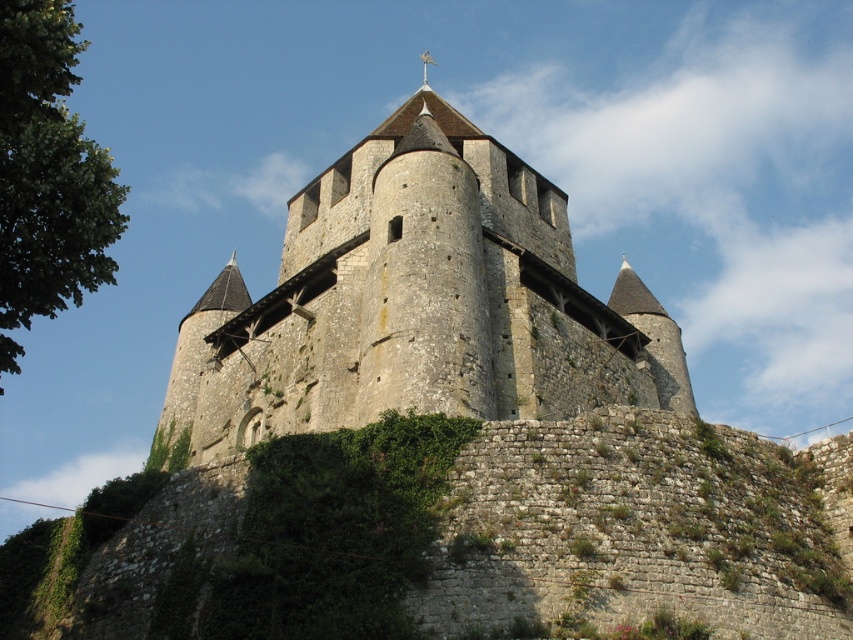
You are standing at the entrance of the medieval stone castle and see two points marked on the castle walls. The first point is at coordinate point (459, 554) and the second is at point (196, 422). Which point is closer to you as you face the castle?

Point (459, 554) is in front of point (196, 422), so the first point is closer to you.

You are an architect examining the medieval stone castle. You notice the green mossy stone wall at center and the stone castle at center. Which structure is located below the other?

The green mossy stone wall at center is positioned under the stone castle at center, meaning the wall is below the castle.